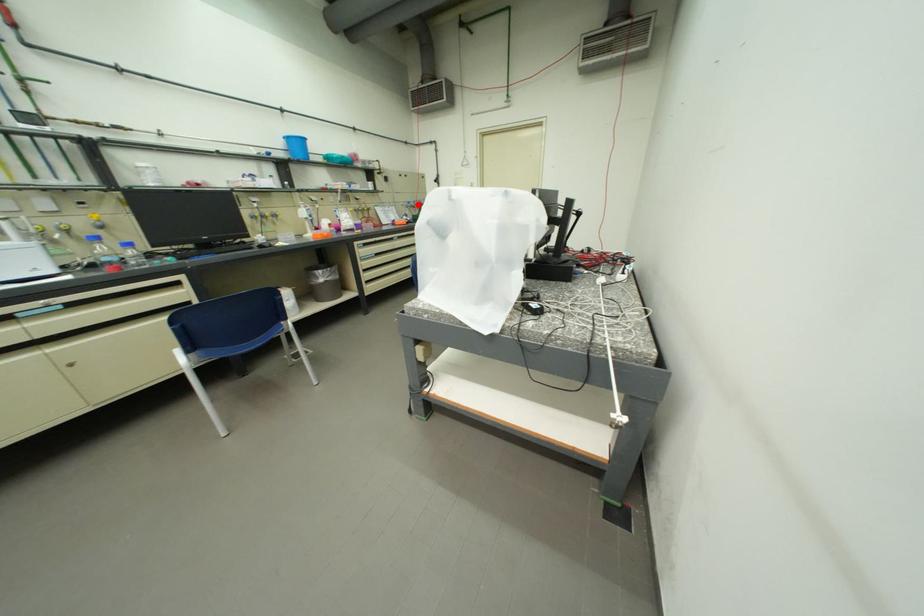
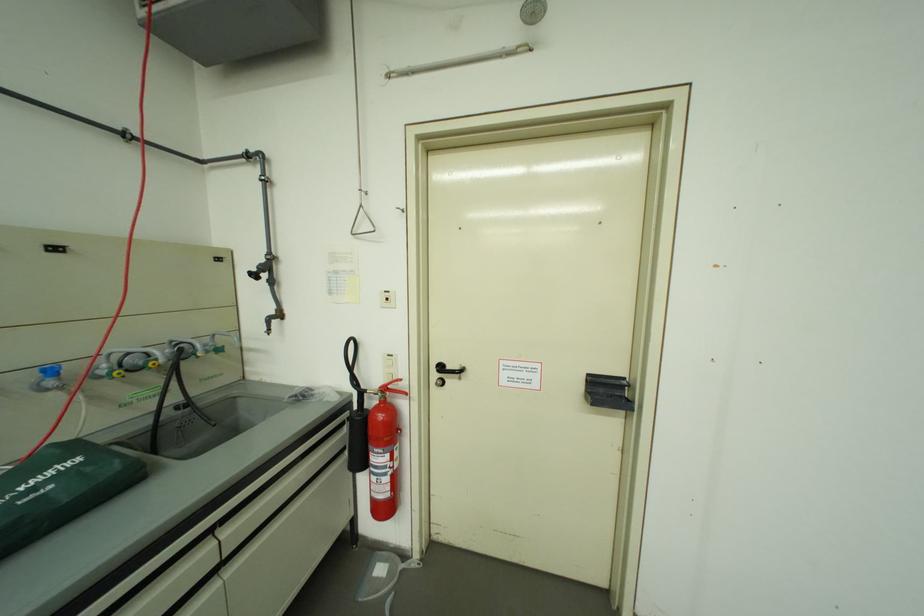
Question: A red point is marked in image1. In image2, is the corresponding 3D point closer to the camera or farther? Reply with the corresponding letter.

Choices:
 (A) The corresponding 3D point is closer.
 (B) The corresponding 3D point is farther.

Answer: (B)